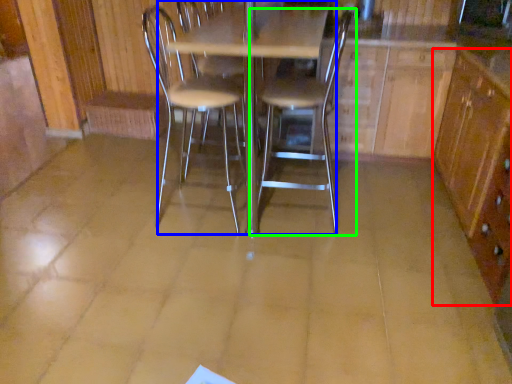
Question: Which object is the closest to the file cabinet (highlighted by a red box)? Choose among these: table (highlighted by a blue box) or chair (highlighted by a green box).

Choices:
 (A) table
 (B) chair

Answer: (B)